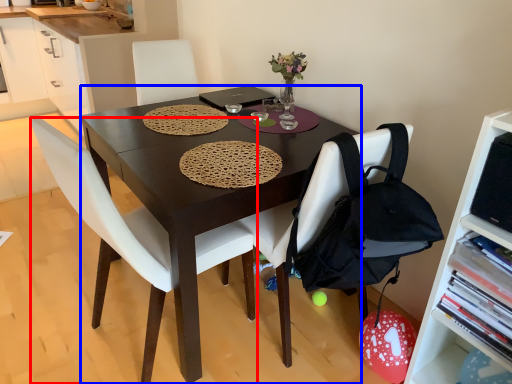
Question: Among these objects, which one is nearest to the camera, chair (highlighted by a red box) or desk (highlighted by a blue box)?

Choices:
 (A) chair
 (B) desk

Answer: (A)